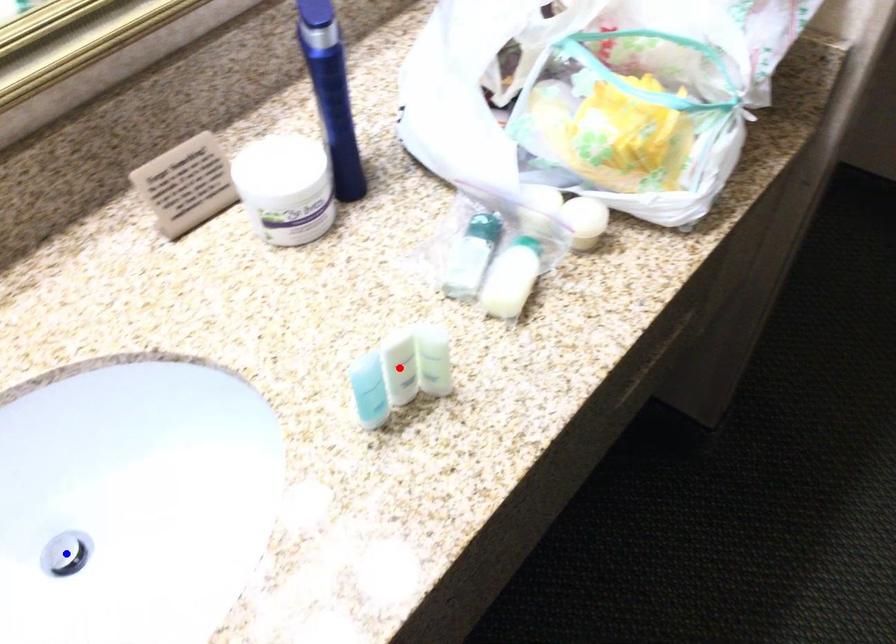
Question: In the image, two points are highlighted. Which point is nearer to the camera? Reply with the corresponding letter.

Choices:
 (A) blue point
 (B) red point

Answer: (B)